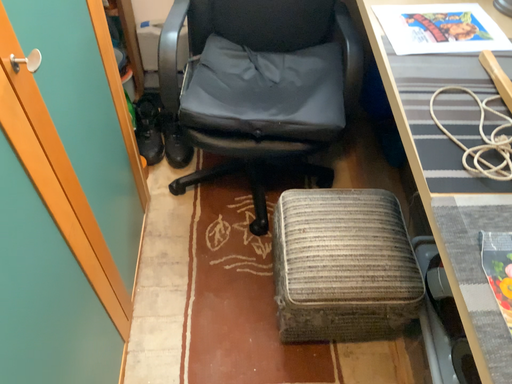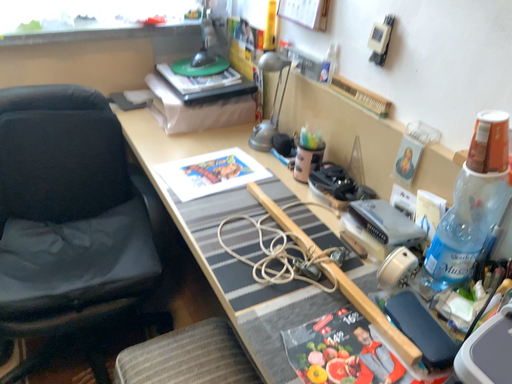
Question: How did the camera likely rotate when shooting the video?

Choices:
 (A) rotated upward
 (B) rotated downward

Answer: (A)